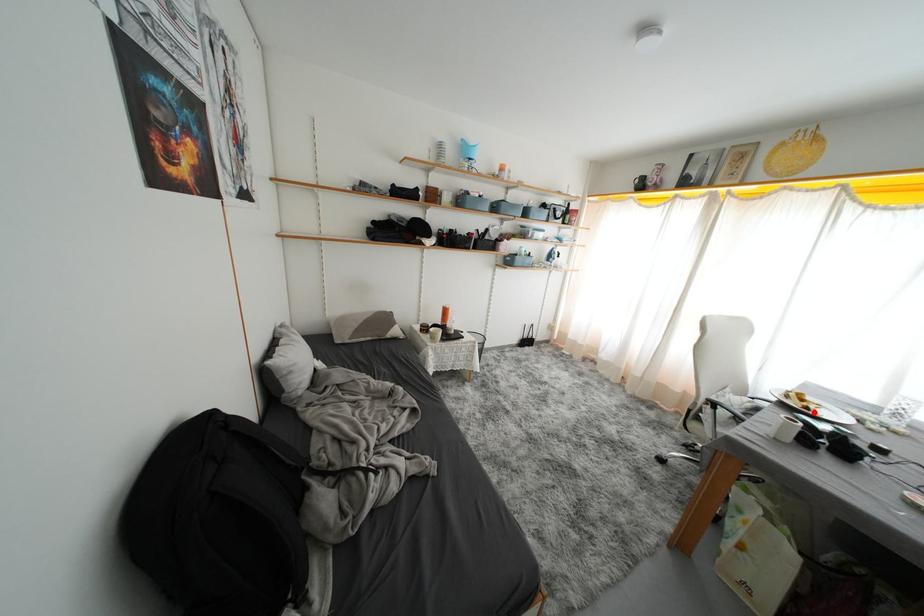
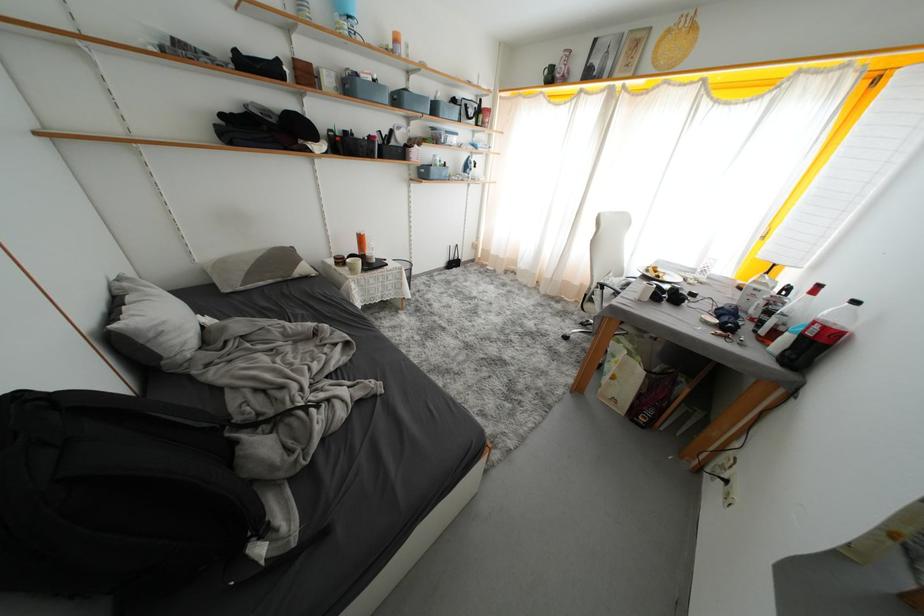
Locate, in the second image, the point that corresponds to the highlighted location in the first image.

(664, 281)